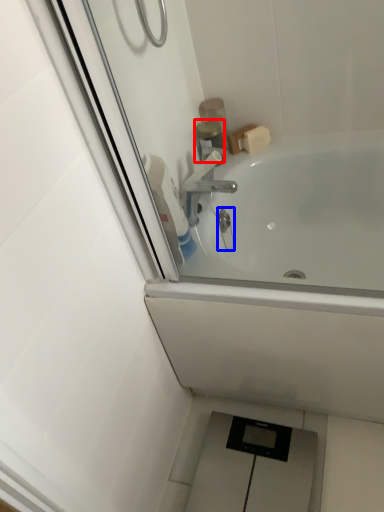
Question: Which object appears closest to the camera in this image, toiletry (highlighted by a red box) or plumbing fixture (highlighted by a blue box)?

Choices:
 (A) toiletry
 (B) plumbing fixture

Answer: (B)